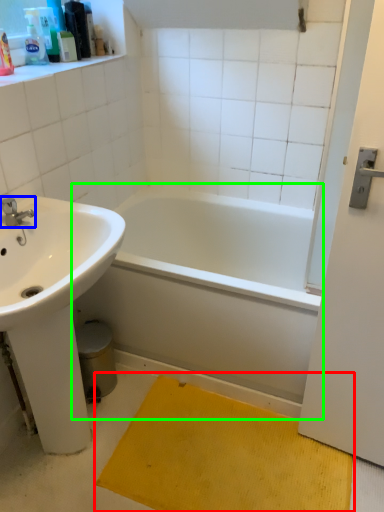
Question: Based on their relative distances, which object is nearer to doormat (highlighted by a red box)? Choose from tap (highlighted by a blue box) and bathtub (highlighted by a green box).

Choices:
 (A) tap
 (B) bathtub

Answer: (B)